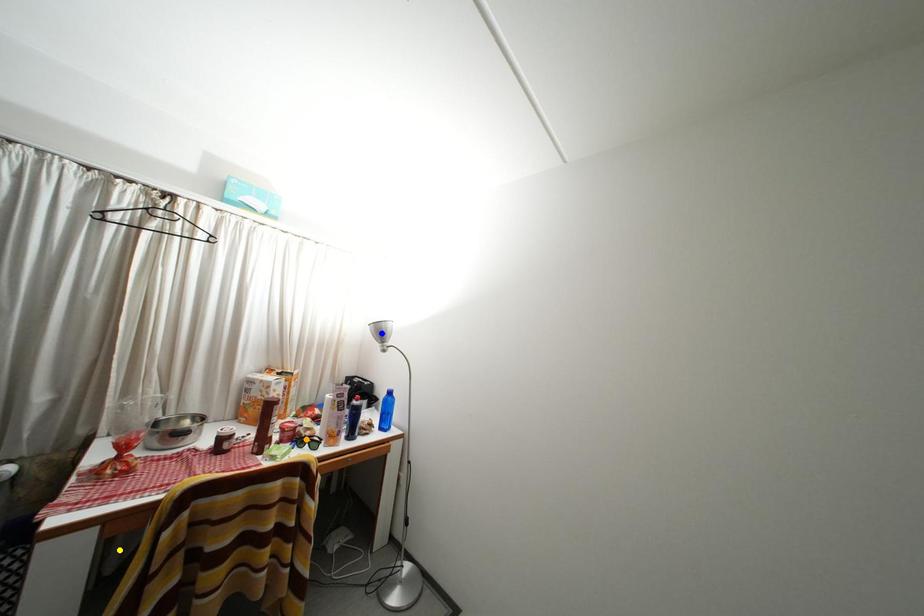
Order these from nearest to farthest:
1. yellow point
2. orange point
3. blue point

yellow point < orange point < blue point